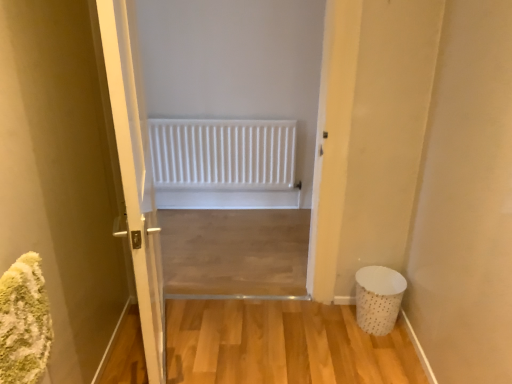
What do you see at coordinates (378, 298) in the screenshot?
I see `white dotted fabric laundry basket at lower right` at bounding box center [378, 298].

Where is `white matte radiator at center`? white matte radiator at center is located at coordinates (223, 154).

Image resolution: width=512 pixels, height=384 pixels. I want to click on white dotted fabric laundry basket at lower right, so click(378, 298).

How many degrees apart are the facing directions of white matte radiator at center and white dotted fabric laundry basket at lower right?

The angle between the facing direction of white matte radiator at center and the facing direction of white dotted fabric laundry basket at lower right is 0.673 degrees.

Considering the relative sizes of white matte radiator at center and white dotted fabric laundry basket at lower right in the image provided, is white matte radiator at center smaller than white dotted fabric laundry basket at lower right?

No, white matte radiator at center is not smaller than white dotted fabric laundry basket at lower right.

From the image's perspective, which object appears higher, white matte radiator at center or white dotted fabric laundry basket at lower right?

white matte radiator at center appears higher in the image.

Considering the relative positions of white matte radiator at center and white glossy door at center in the image provided, is white matte radiator at center in front of white glossy door at center?

No.

Would you say white matte radiator at center is inside or outside white glossy door at center?

white matte radiator at center is not inside white glossy door at center, it's outside.

Is white matte radiator at center oriented away from white glossy door at center?

white matte radiator at center does not have its back to white glossy door at center.

Is point (156, 256) more distant than point (372, 288)?

That is False.

Is white glossy door at center surrounding white dotted fabric laundry basket at lower right?

Actually, white dotted fabric laundry basket at lower right is outside white glossy door at center.

From the image's perspective, is white glossy door at center under white dotted fabric laundry basket at lower right?

No, from the image's perspective, white glossy door at center is not below white dotted fabric laundry basket at lower right.

Who is bigger, white glossy door at center or white dotted fabric laundry basket at lower right?

white glossy door at center is bigger.

Considering the sizes of white glossy door at center and white matte radiator at center in the image, is white glossy door at center bigger or smaller than white matte radiator at center?

white glossy door at center is bigger than white matte radiator at center.

Can you tell me how much white glossy door at center and white matte radiator at center differ in facing direction?

The facing directions of white glossy door at center and white matte radiator at center are 103 degrees apart.

Is white glossy door at center oriented towards white matte radiator at center?

No, white glossy door at center is not aimed at white matte radiator at center.

From the image's perspective, which is below, white glossy door at center or white matte radiator at center?

white glossy door at center, from the image's perspective.

Is white dotted fabric laundry basket at lower right to the left of white glossy door at center from the viewer's perspective?

No, white dotted fabric laundry basket at lower right is not to the left of white glossy door at center.

Does point (402, 291) come in front of point (124, 146)?

No, it is not.

How different are the orientations of white dotted fabric laundry basket at lower right and white glossy door at center in degrees?

The angle between the facing direction of white dotted fabric laundry basket at lower right and the facing direction of white glossy door at center is 102 degrees.

How much distance is there between white dotted fabric laundry basket at lower right and white glossy door at center?

white dotted fabric laundry basket at lower right and white glossy door at center are 3.77 feet apart.

Which object is more forward, white dotted fabric laundry basket at lower right or white matte radiator at center?

white dotted fabric laundry basket at lower right is closer to the camera.

How much distance is there between white dotted fabric laundry basket at lower right and white matte radiator at center?

They are 4.48 feet apart.

Looking at this image, considering the relative sizes of white dotted fabric laundry basket at lower right and white matte radiator at center in the image provided, is white dotted fabric laundry basket at lower right smaller than white matte radiator at center?

Yes.

From a real-world perspective, is white dotted fabric laundry basket at lower right physically below white matte radiator at center?

Yes, from a real-world perspective, white dotted fabric laundry basket at lower right is under white matte radiator at center.

Identify the location of laundry basket below the white matte radiator at center (from a real-world perspective). (378, 298).

Locate an element on the screen. This screenshot has width=512, height=384. door above the white matte radiator at center (from a real-world perspective) is located at coordinates (135, 171).

Based on their spatial positions, is white glossy door at center or white matte radiator at center further from white dotted fabric laundry basket at lower right?

white matte radiator at center is further to white dotted fabric laundry basket at lower right.

From the image, which object appears to be nearer to white matte radiator at center, white glossy door at center or white dotted fabric laundry basket at lower right?

Among the two, white dotted fabric laundry basket at lower right is located nearer to white matte radiator at center.

When comparing their distances from white glossy door at center, does white dotted fabric laundry basket at lower right or white matte radiator at center seem closer?

Among the two, white dotted fabric laundry basket at lower right is located nearer to white glossy door at center.

When comparing their distances from white matte radiator at center, does white dotted fabric laundry basket at lower right or white glossy door at center seem further?

white glossy door at center is positioned further to the anchor white matte radiator at center.

Estimate the real-world distances between objects in this image. Which object is further from white glossy door at center, white matte radiator at center or white dotted fabric laundry basket at lower right?

The object further to white glossy door at center is white matte radiator at center.

Looking at the image, which one is located closer to white dotted fabric laundry basket at lower right, white matte radiator at center or white glossy door at center?

The object closer to white dotted fabric laundry basket at lower right is white glossy door at center.

Where is `laundry basket between white glossy door at center and white matte radiator at center in the front-back direction`? The height and width of the screenshot is (384, 512). laundry basket between white glossy door at center and white matte radiator at center in the front-back direction is located at coordinates (378, 298).